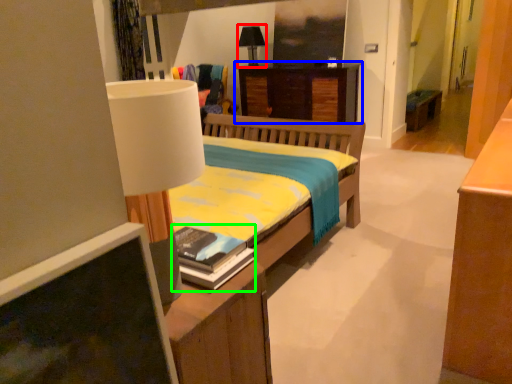
Question: Based on their relative distances, which object is farther from table lamp (highlighted by a red box)? Choose from desk (highlighted by a blue box) and book (highlighted by a green box).

Choices:
 (A) desk
 (B) book

Answer: (B)